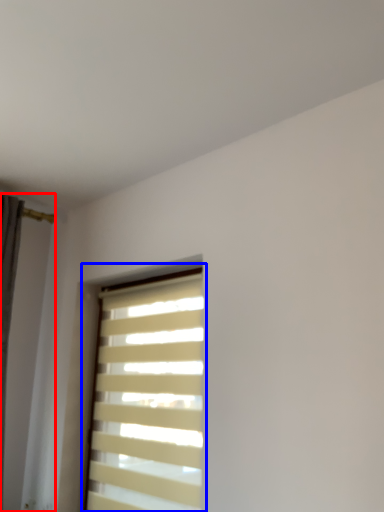
Question: Which object appears closest to the camera in this image, shutter (highlighted by a red box) or window blind (highlighted by a blue box)?

Choices:
 (A) shutter
 (B) window blind

Answer: (A)